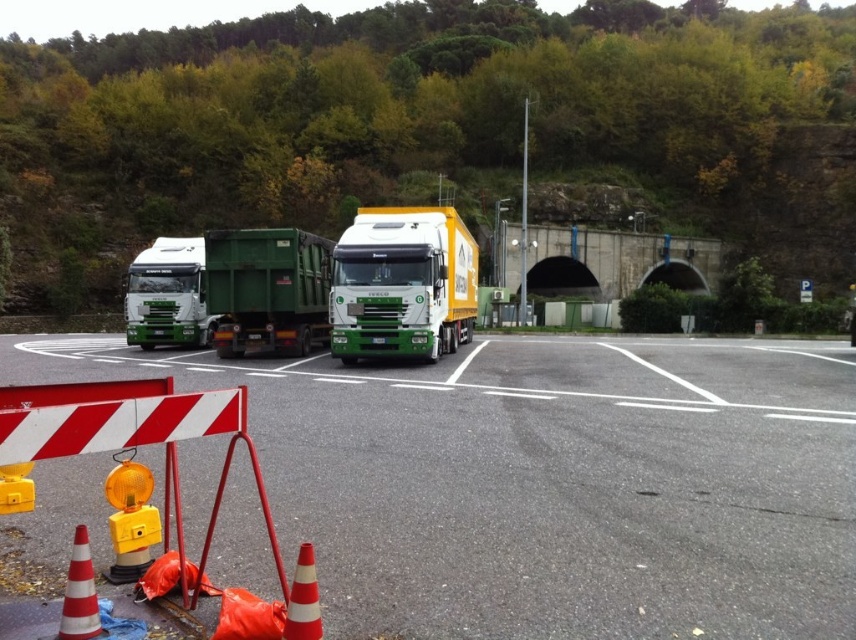
Between point (563, 273) and point (156, 266), which one is positioned in front?

Point (156, 266) is more forward.

Looking at this image, who is taller, concrete tunnel at center or green matte truck at left?

concrete tunnel at center

Is point (623, 289) more distant than point (149, 289)?

Yes, point (623, 289) is behind point (149, 289).

I want to click on concrete tunnel at center, so click(617, 260).

Between gray asphalt parking lot at center and orange reflective cone at lower left, which one appears on the right side from the viewer's perspective?

gray asphalt parking lot at center

Who is taller, gray asphalt parking lot at center or orange reflective cone at lower left?

orange reflective cone at lower left

Locate an element on the screen. gray asphalt parking lot at center is located at coordinates (547, 483).

Between green matte trailer truck at center and green matte truck at left, which one appears on the right side from the viewer's perspective?

green matte trailer truck at center is more to the right.

Who is lower down, green matte trailer truck at center or green matte truck at left?

Positioned lower is green matte trailer truck at center.

What do you see at coordinates (266, 289) in the screenshot? I see `green matte trailer truck at center` at bounding box center [266, 289].

The image size is (856, 640). In order to click on green matte trailer truck at center in this screenshot , I will do `click(266, 289)`.